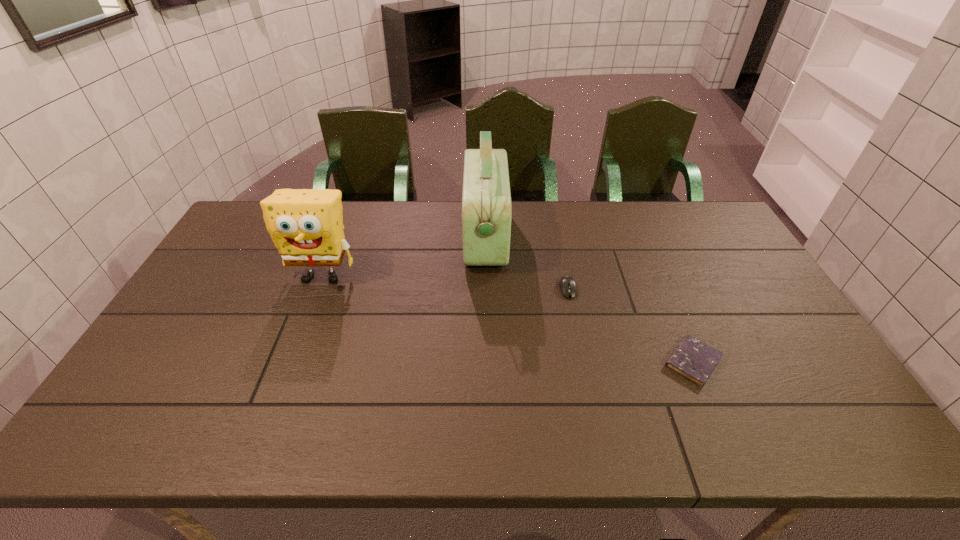
Identify the location of vacant point that satisfies the following two spatial constraints: 1. on the face of the leftmost object; 2. on the left side of the shortest object. click(289, 362).

This screenshot has height=540, width=960. I want to click on vacant area in the image that satisfies the following two spatial constraints: 1. on the face of the leftmost object; 2. on the left side of the shortest object, so click(x=289, y=362).

At what (x,y) coordinates should I click in order to perform the action: click on vacant space that satisfies the following two spatial constraints: 1. on the back side of the diary; 2. on the front panel of the second object from left to right. Please return your answer as a coordinate pair (x, y). This screenshot has height=540, width=960. Looking at the image, I should click on (639, 237).

Find the location of a particular element. vacant region that satisfies the following two spatial constraints: 1. on the front panel of the third object from right to left; 2. on the face of the third shortest object is located at coordinates (485, 275).

In order to click on vacant space that satisfies the following two spatial constraints: 1. on the front panel of the radio receiver; 2. on the face of the leftmost object in this screenshot , I will do `click(485, 275)`.

At what (x,y) coordinates should I click in order to perform the action: click on vacant area that satisfies the following two spatial constraints: 1. on the front panel of the diary; 2. on the left side of the second object from left to right. Please return your answer as a coordinate pair (x, y). Looking at the image, I should click on (486, 362).

The width and height of the screenshot is (960, 540). What are the coordinates of `free space that satisfies the following two spatial constraints: 1. on the front panel of the nearest object; 2. on the right side of the radio receiver` in the screenshot? It's located at (486, 362).